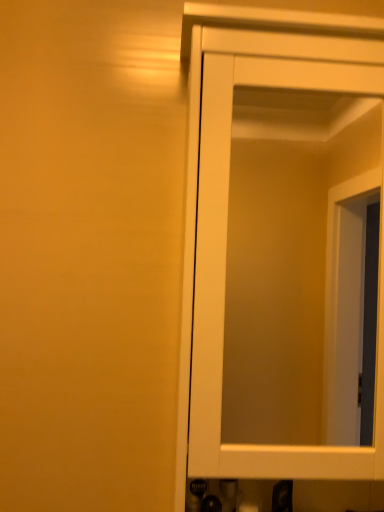
Where is `white matte cupboard at right`? The image size is (384, 512). white matte cupboard at right is located at coordinates (279, 239).

Measure the distance between point [208,181] and camera.

Point [208,181] and camera are 28.54 inches apart.

Image resolution: width=384 pixels, height=512 pixels. Describe the element at coordinates (279, 239) in the screenshot. I see `white matte cupboard at right` at that location.

In order to face white matte cupboard at right, should I rotate leftwards or rightwards?

You should rotate right by 13.183 degrees.

The image size is (384, 512). In order to click on white matte cupboard at right in this screenshot , I will do coord(279,239).